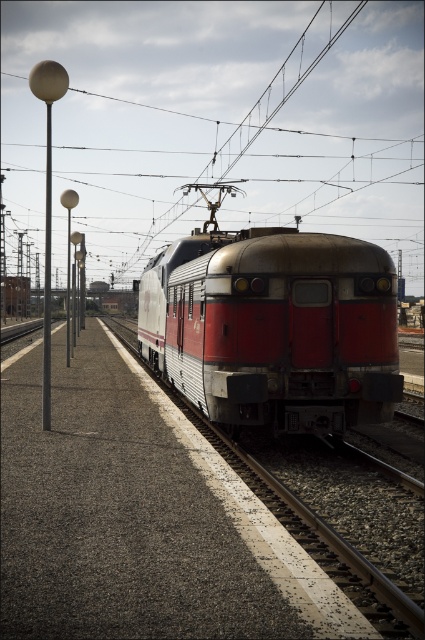
This screenshot has width=425, height=640. What do you see at coordinates (274, 326) in the screenshot?
I see `silver metallic train at center` at bounding box center [274, 326].

Does silver metallic train at center appear under metallic pole at left?

Indeed, silver metallic train at center is positioned under metallic pole at left.

Between point (345, 291) and point (48, 186), which one is positioned behind?

Point (48, 186)

Where is `silver metallic train at center`? silver metallic train at center is located at coordinates (274, 326).